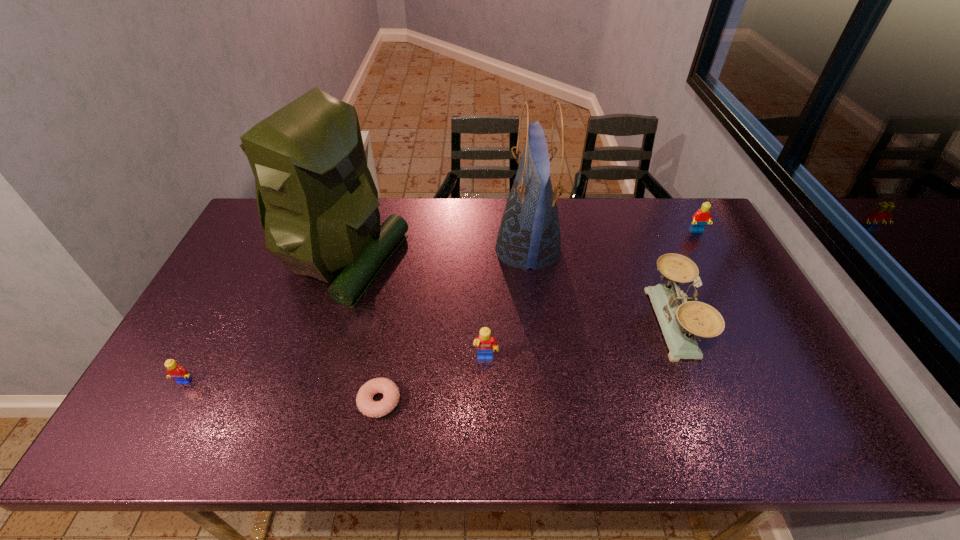
The width and height of the screenshot is (960, 540). I want to click on unoccupied area between the scale and the leftmost Lego, so click(429, 353).

Locate an element on the screen. vacant space that is in between the leftmost object and the backpack is located at coordinates (263, 321).

Locate an element on the screen. This screenshot has width=960, height=540. vacant space that is in between the shopping bag and the sixth object from left to right is located at coordinates (601, 287).

The image size is (960, 540). Identify the location of vacant space in between the third object from right to left and the doughnut. pyautogui.click(x=454, y=326).

Identify the location of object that ranks as the fifth closest to the fifth object from left to right. (700, 218).

Where is `object identified as the closest to the rightmost Lego`? This screenshot has width=960, height=540. object identified as the closest to the rightmost Lego is located at coordinates (680, 322).

Identify the location of the second closest Lego to the farthest Lego. (174, 370).

The width and height of the screenshot is (960, 540). Find the location of `Lego that is the closest to the nearest Lego`. Lego that is the closest to the nearest Lego is located at coordinates (486, 344).

This screenshot has height=540, width=960. Find the location of `vacant space that satisfies the following two spatial constraints: 1. on the face of the rightmost Lego; 2. on the front of the backpack with visible pockets`. vacant space that satisfies the following two spatial constraints: 1. on the face of the rightmost Lego; 2. on the front of the backpack with visible pockets is located at coordinates (712, 260).

Where is `vacant area in the image that satisfies the following two spatial constraints: 1. on the front of the backpack with visible pockets; 2. on the front-facing side of the shortest Lego`? vacant area in the image that satisfies the following two spatial constraints: 1. on the front of the backpack with visible pockets; 2. on the front-facing side of the shortest Lego is located at coordinates (301, 381).